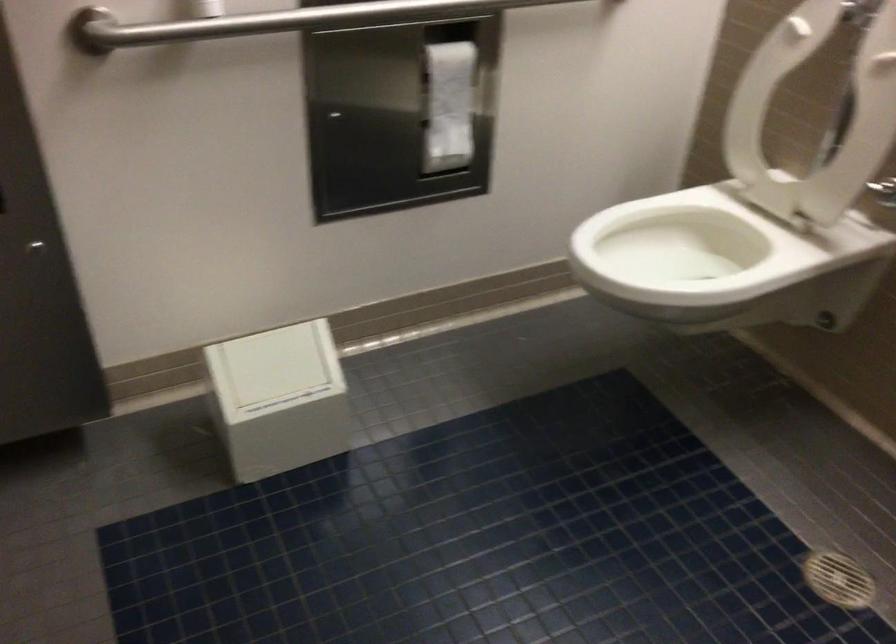
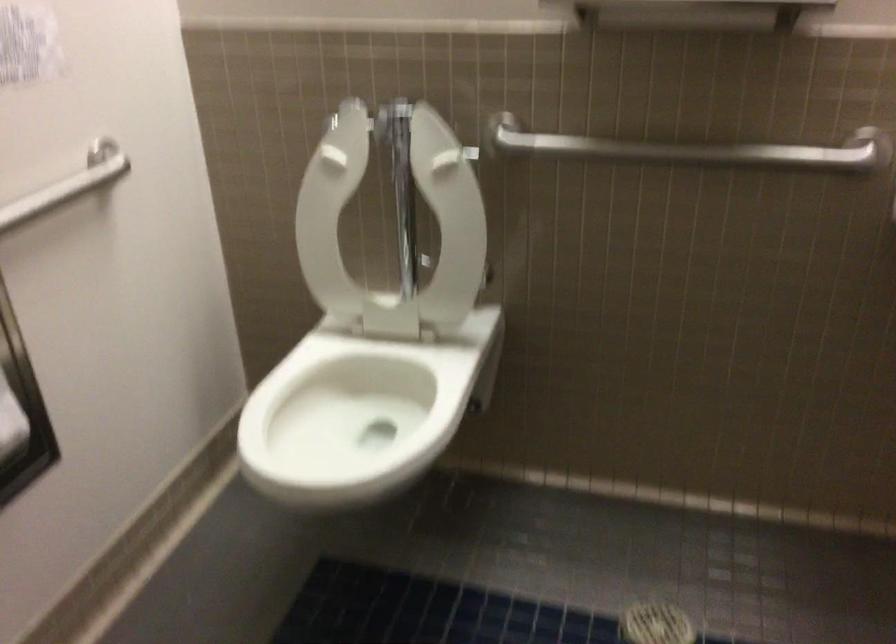
Question: The images are taken continuously from a first-person perspective. In which direction is your viewpoint rotating?

Choices:
 (A) Left
 (B) Right
 (C) Up
 (D) Down

Answer: (B)